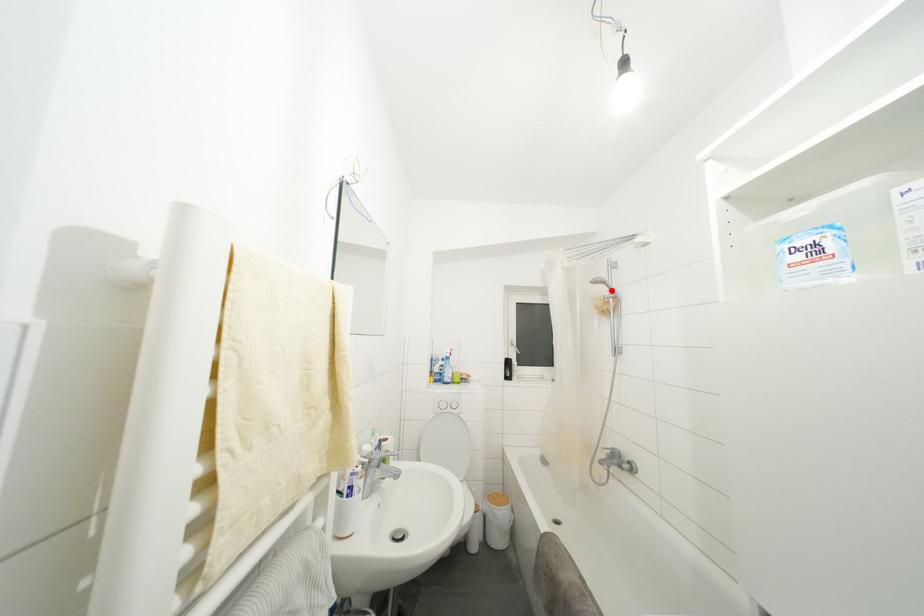
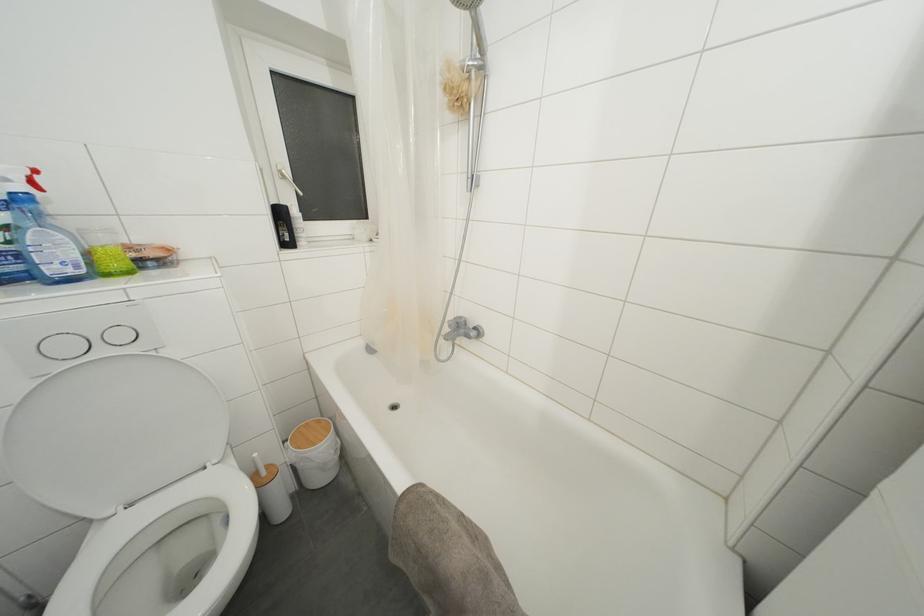
Find the pixel in the second image that matches the highlighted location in the first image.

(480, 31)